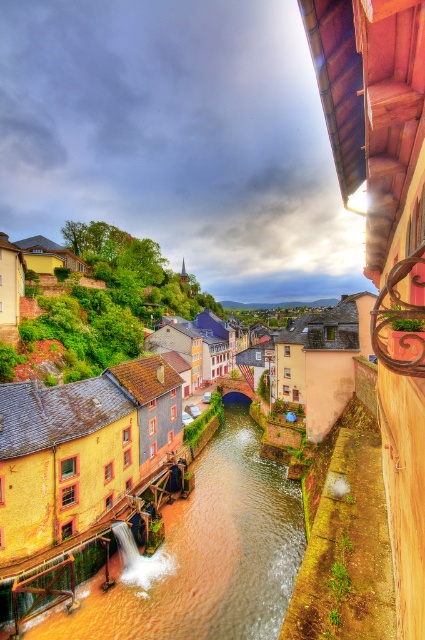
Question: Which point is farther to the camera?

Choices:
 (A) (5, 465)
 (B) (142, 604)

Answer: (B)

Question: Among these points, which one is nearest to the camera?

Choices:
 (A) (136, 417)
 (B) (241, 488)

Answer: (A)

Question: Can you confirm if brown smooth water at lower center is smaller than yellow matte building at center?

Choices:
 (A) no
 (B) yes

Answer: (B)

Question: Can you confirm if brown smooth water at lower center is positioned to the right of yellow matte building at center?

Choices:
 (A) yes
 (B) no

Answer: (A)

Question: Does brown smooth water at lower center appear under yellow matte building at center?

Choices:
 (A) no
 (B) yes

Answer: (B)